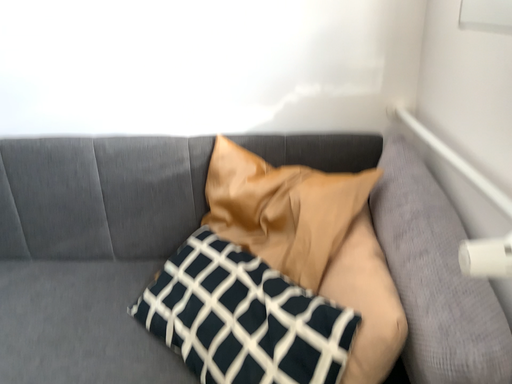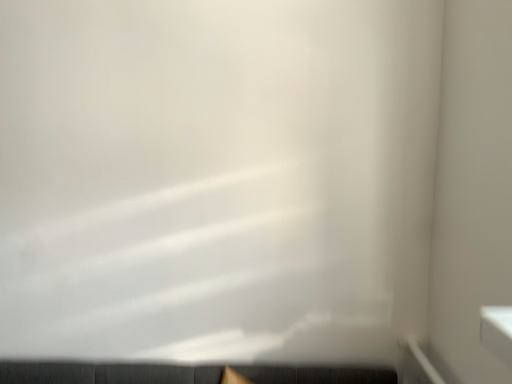
Question: How did the camera likely rotate when shooting the video?

Choices:
 (A) rotated downward
 (B) rotated upward

Answer: (B)